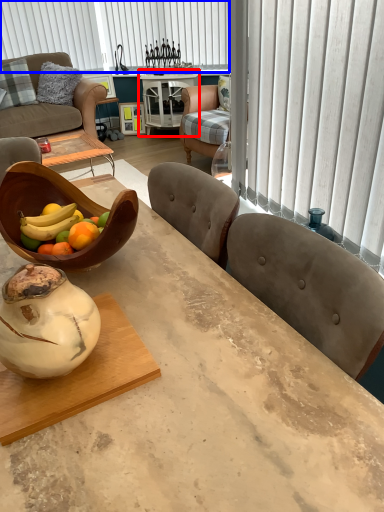
Question: Among these objects, which one is farthest to the camera, round table (highlighted by a red box) or blind (highlighted by a blue box)?

Choices:
 (A) round table
 (B) blind

Answer: (B)